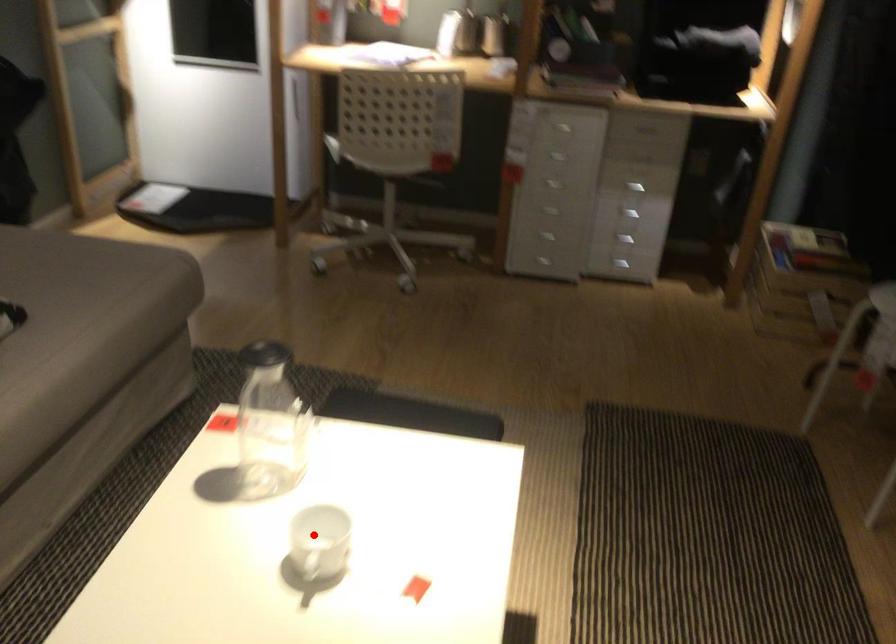
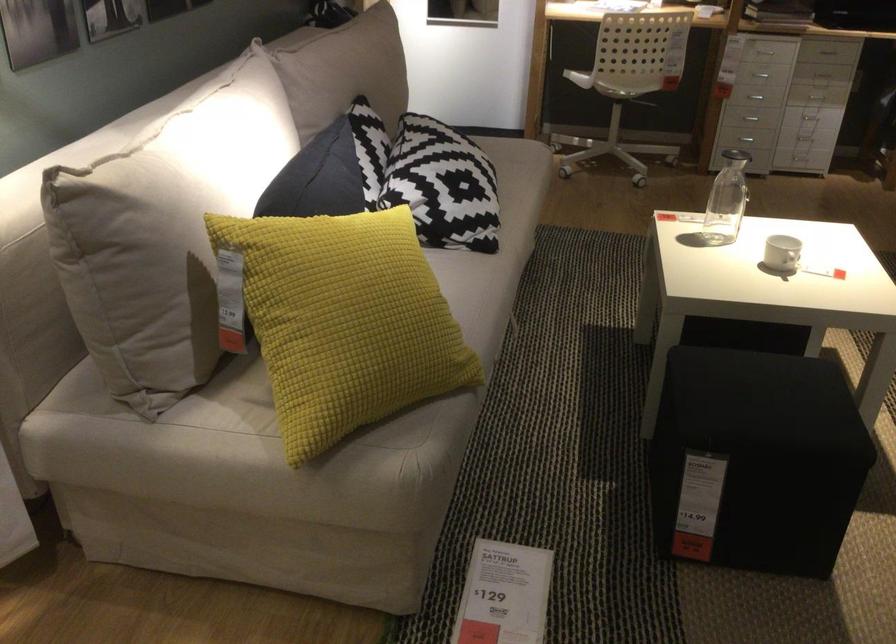
Where in the second image is the point corresponding to the highlighted location from the first image?

(781, 252)